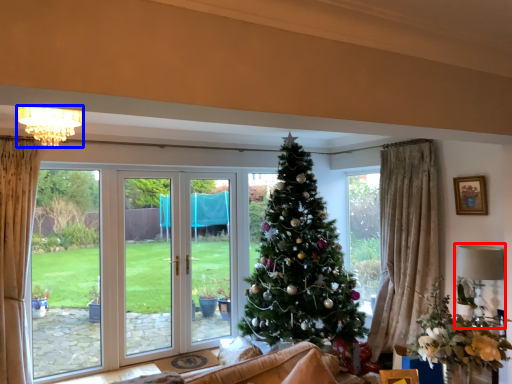
Question: Among these objects, which one is farthest to the camera, lamp (highlighted by a red box) or light (highlighted by a blue box)?

Choices:
 (A) lamp
 (B) light

Answer: (A)